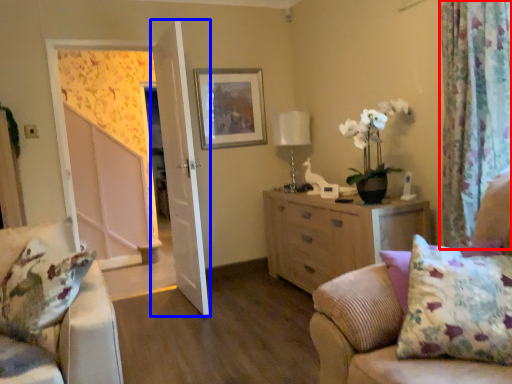
Question: Which object is closer to the camera taking this photo, curtain (highlighted by a red box) or door (highlighted by a blue box)?

Choices:
 (A) curtain
 (B) door

Answer: (A)